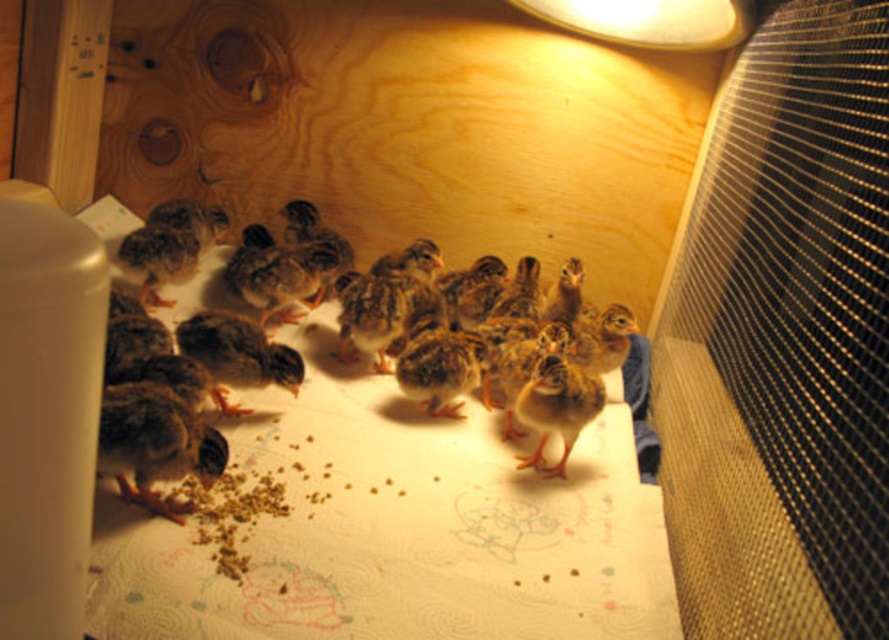
From the picture: Is black mesh screen at right taller than metallic silver lampshade at upper center?

Indeed, black mesh screen at right has a greater height compared to metallic silver lampshade at upper center.

Which of these two, black mesh screen at right or metallic silver lampshade at upper center, stands taller?

With more height is black mesh screen at right.

Describe the element at coordinates (783, 340) in the screenshot. I see `black mesh screen at right` at that location.

The image size is (889, 640). In order to click on black mesh screen at right in this screenshot , I will do `click(783, 340)`.

Does black mesh screen at right have a larger size compared to brown speckled chicks at center?

No.

Who is shorter, black mesh screen at right or brown speckled chicks at center?

Standing shorter between the two is brown speckled chicks at center.

Does point (690, 568) come in front of point (111, 196)?

Yes.

Locate an element on the screen. This screenshot has height=640, width=889. black mesh screen at right is located at coordinates (783, 340).

How far apart are brown speckled chicks at center and metallic silver lampshade at upper center?

brown speckled chicks at center and metallic silver lampshade at upper center are 73.88 centimeters apart from each other.

Who is more forward, (271,401) or (607,40)?

Positioned in front is point (271,401).

This screenshot has width=889, height=640. I want to click on brown speckled chicks at center, so click(363, 403).